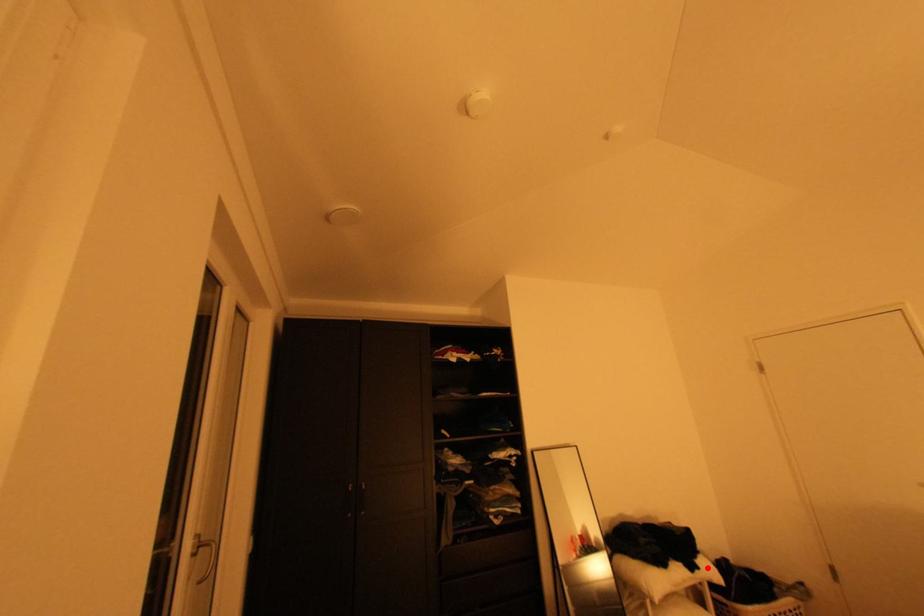
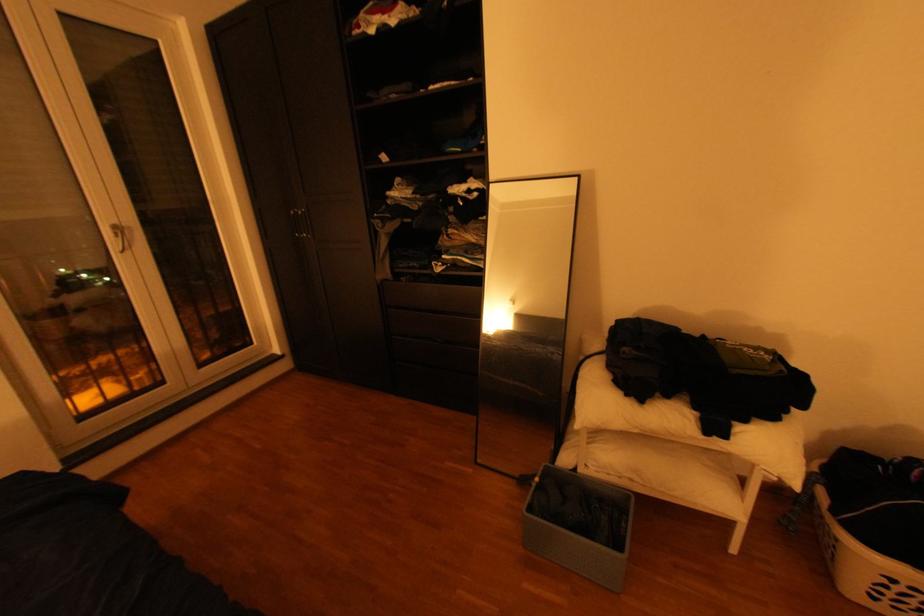
Locate, in the second image, the point that corresponds to the highlighted location in the first image.

(735, 436)